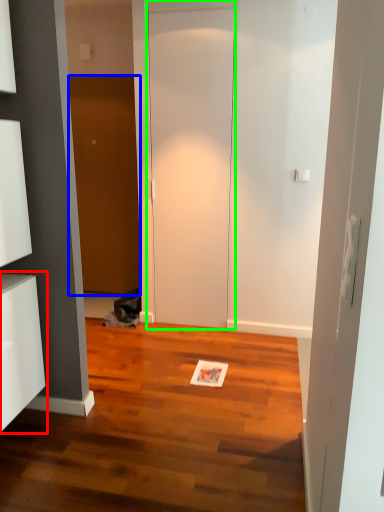
Question: Estimate the real-world distances between objects in this image. Which object is closer to cabinetry (highlighted by a red box), door (highlighted by a blue box) or door (highlighted by a green box)?

Choices:
 (A) door
 (B) door

Answer: (B)